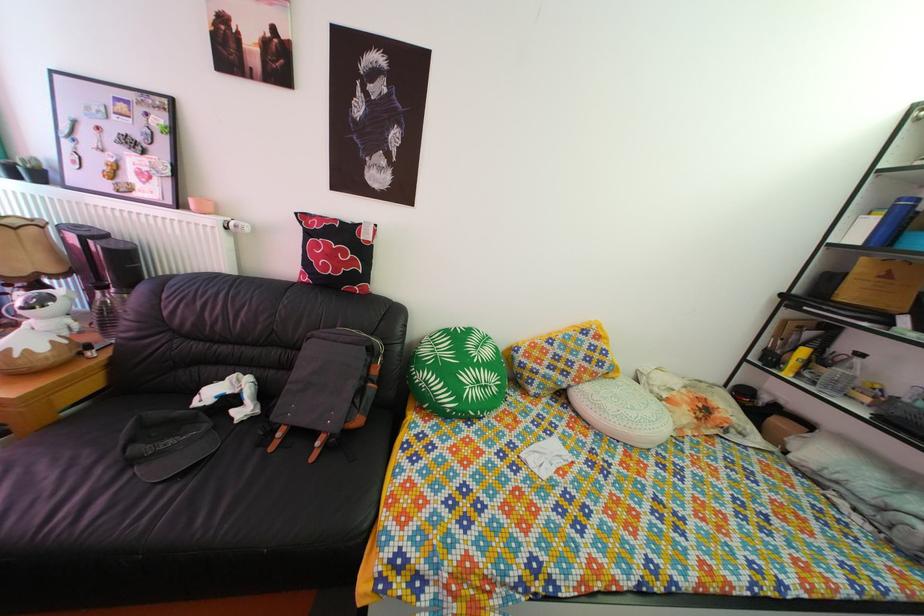
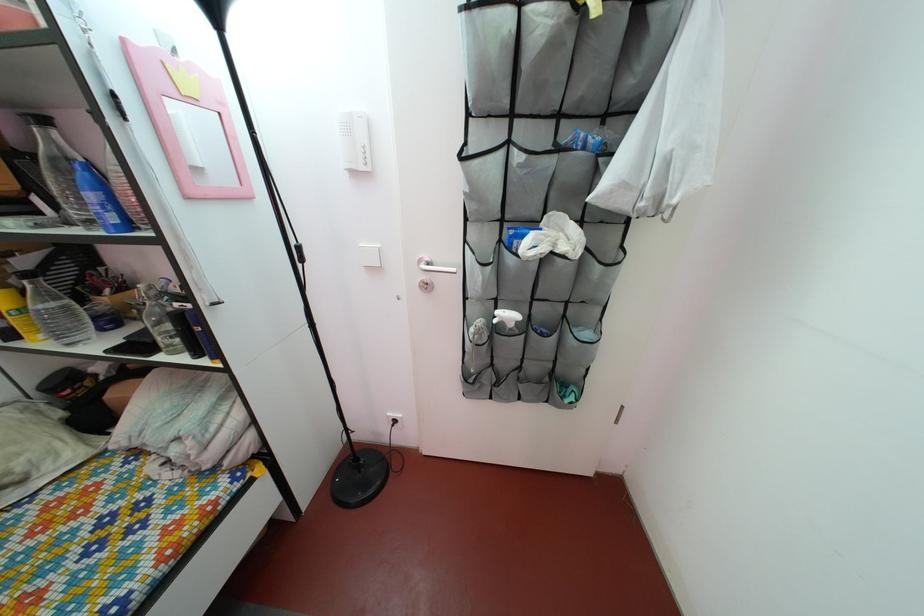
Question: I am providing you with two images of the same scene from different viewpoints. Which of the following objects are not visible in image2?

Choices:
 (A) dark water bottle
 (B) white light switch
 (C) clear ridged bottle
 (D) none of these

Answer: (D)